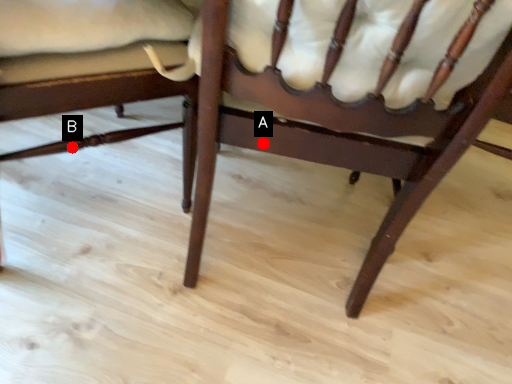
Question: Two points are circled on the image, labeled by A and B beside each circle. Which point is farther from the camera taking this photo?

Choices:
 (A) A is further
 (B) B is further

Answer: (B)